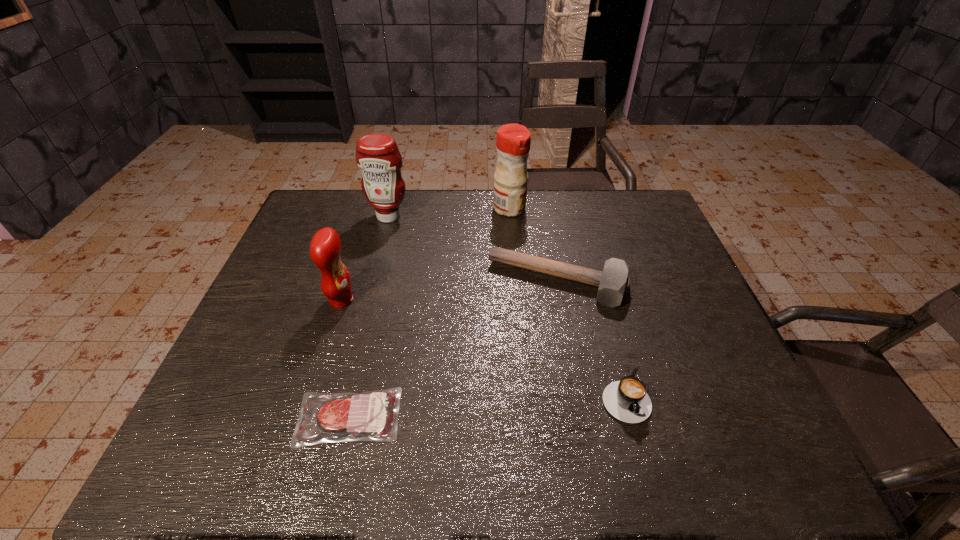
Locate an element on the screen. The image size is (960, 540). unoccupied area between the rightmost condiment and the shortest object is located at coordinates (429, 313).

At what (x,y) coordinates should I click in order to perform the action: click on free spot between the nearest condiment and the steak. Please return your answer as a coordinate pair (x, y). The image size is (960, 540). Looking at the image, I should click on (345, 359).

In order to click on vacant area that lies between the mallet and the cappuccino in this screenshot , I will do `click(591, 338)`.

The image size is (960, 540). I want to click on free area in between the rightmost condiment and the cappuccino, so click(x=566, y=302).

Locate an element on the screen. vacant region between the nearest condiment and the steak is located at coordinates (345, 359).

Locate an element on the screen. This screenshot has width=960, height=540. the second closest object to the shortest condiment is located at coordinates (377, 155).

Identify which object is the fourth closest to the rightmost condiment. Please provide its 2D coordinates. Your answer should be formatted as a tuple, i.e. [(x, y)], where the tuple contains the x and y coordinates of a point satisfying the conditions above.

[(627, 400)]

Choose which condiment is the nearest neighbor to the shortest object. Please provide its 2D coordinates. Your answer should be formatted as a tuple, i.e. [(x, y)], where the tuple contains the x and y coordinates of a point satisfying the conditions above.

[(325, 246)]

Where is `condiment object that ranks as the third closest to the mallet`? This screenshot has height=540, width=960. condiment object that ranks as the third closest to the mallet is located at coordinates (325, 246).

Locate an element on the screen. The image size is (960, 540). free point that satisfies the following two spatial constraints: 1. on the label side of the nearest condiment; 2. on the right side of the shortest object is located at coordinates (304, 417).